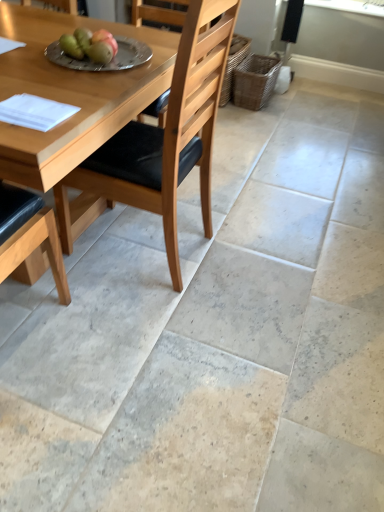
Image resolution: width=384 pixels, height=512 pixels. In order to click on free space in front of green matte pears at upper center, the first fruit in the right-to-left sequence in this screenshot , I will do `click(78, 78)`.